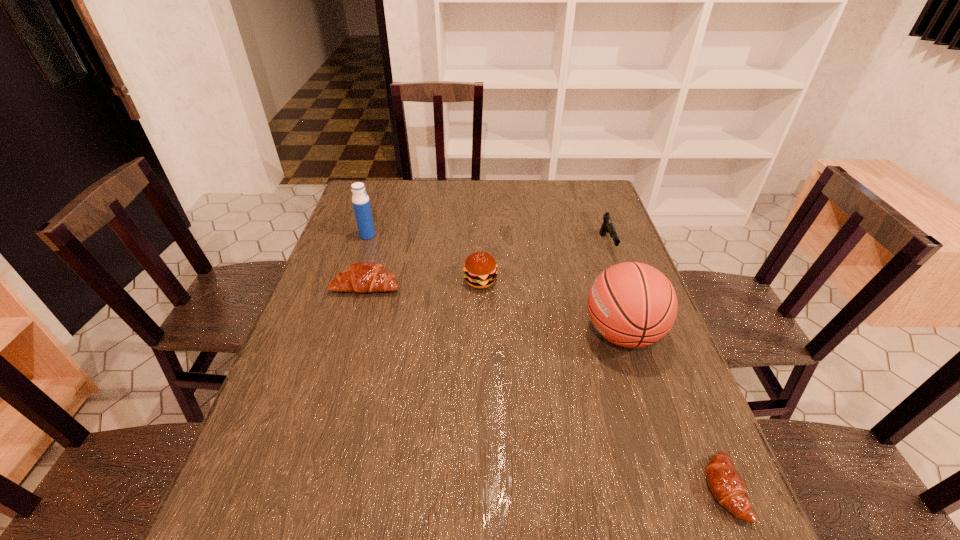
What are the coordinates of `the left crescent roll` in the screenshot? It's located at (363, 277).

Identify the location of the farther crescent roll. (363, 277).

You are a GUI agent. You are given a task and a screenshot of the screen. Output one action in this format:
    pyautogui.click(x=<x>, y=<y>)
    Task: Click on the shortest object
    The width and height of the screenshot is (960, 540).
    Given the screenshot: What is the action you would take?
    pyautogui.click(x=727, y=486)

Where is `the nearest object`? the nearest object is located at coordinates (727, 486).

Locate an element on the screen. Image resolution: width=960 pixels, height=540 pixels. gun is located at coordinates (607, 227).

Where is `hamburger`? Image resolution: width=960 pixels, height=540 pixels. hamburger is located at coordinates (480, 269).

The width and height of the screenshot is (960, 540). Identify the location of water bottle. [360, 200].

I want to click on the second nearest object, so click(x=631, y=304).

You are a GUI agent. You are given a task and a screenshot of the screen. Output one action in this format:
    pyautogui.click(x=<x>, y=<y>)
    Task: Click on the free space located on the right of the fifth tallest object
    
    Given the screenshot: What is the action you would take?
    pyautogui.click(x=465, y=285)

Find the location of a particular element. free spot located on the left of the shortest object is located at coordinates (523, 489).